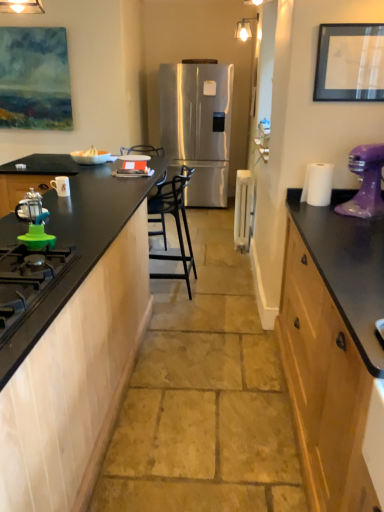
This screenshot has width=384, height=512. What are the coordinates of `vacant space in front of white plastic radiator at center, the fifth appliance positioned from the left` in the screenshot? It's located at (231, 255).